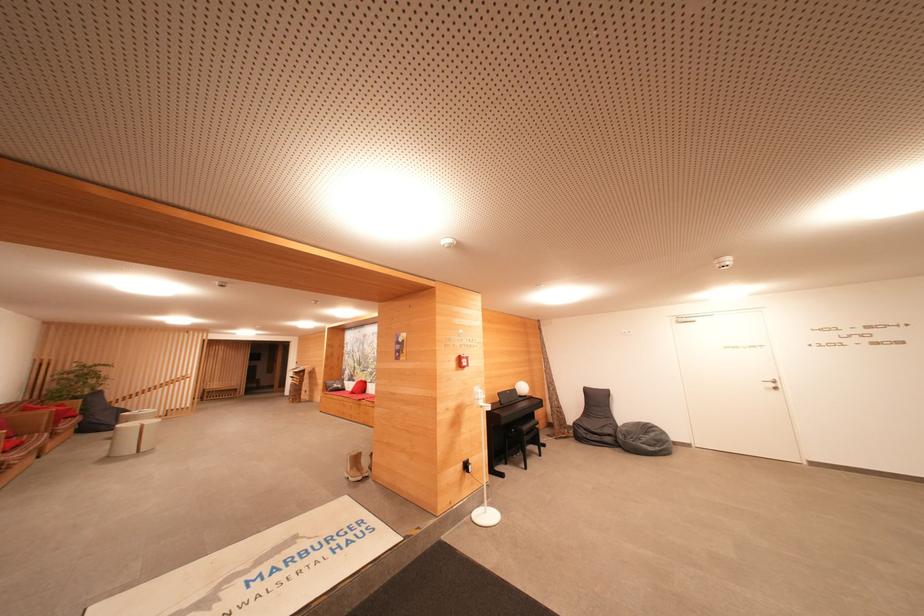
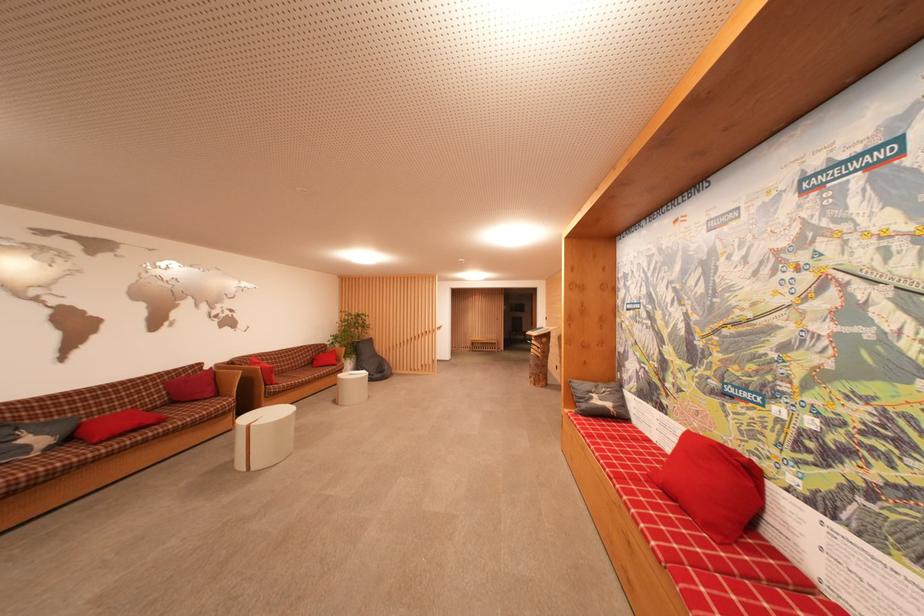
Where in the second image is the point corresponding to the point at 339,389 from the first image?

(601, 405)